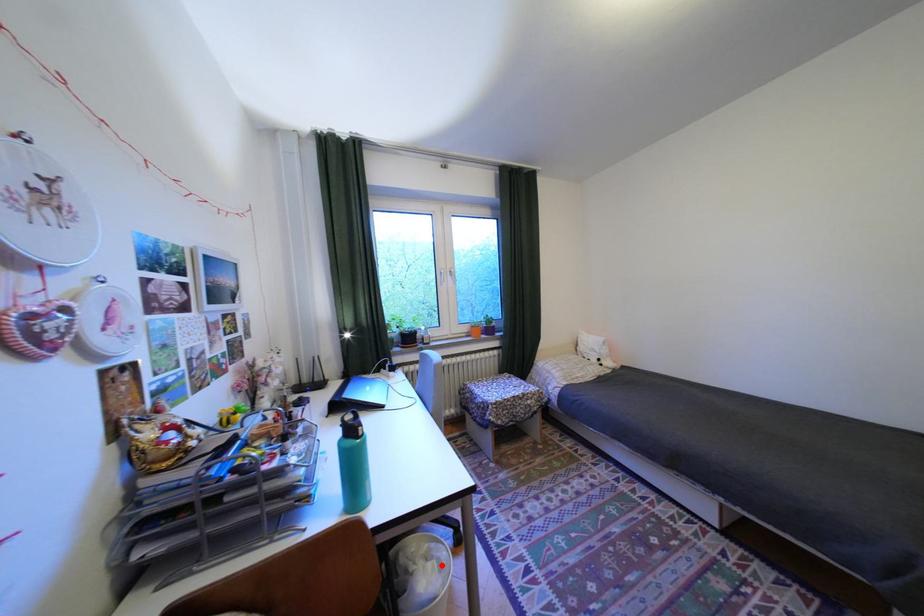
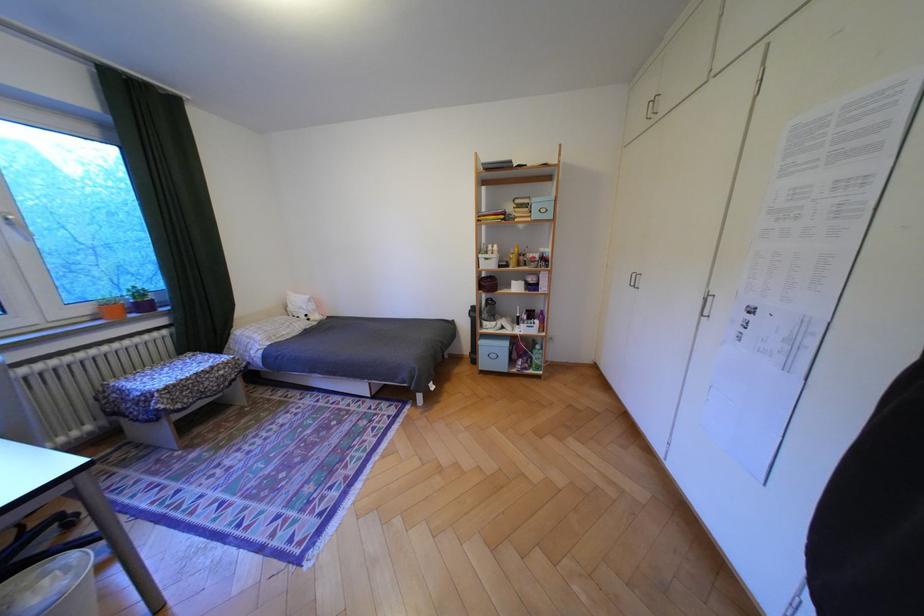
Question: I am providing you with two images of the same scene from different viewpoints. Image1 has a red point marked. In image2, the corresponding 3D location appears at what relative position? Reply with the corresponding letter.

Choices:
 (A) Closer
 (B) Farther

Answer: (B)